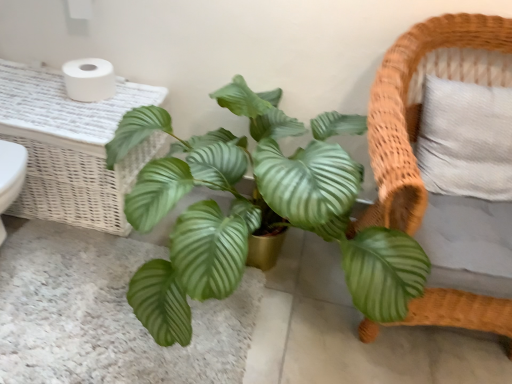
Question: Is white wicker table at upper left closer to the viewer compared to green glossy leaf at center?

Choices:
 (A) yes
 (B) no

Answer: (B)

Question: Does white wicker table at upper left have a smaller size compared to green glossy leaf at center?

Choices:
 (A) yes
 (B) no

Answer: (B)

Question: Is white wicker table at upper left facing away from green glossy leaf at center?

Choices:
 (A) yes
 (B) no

Answer: (B)

Question: Does white wicker table at upper left come behind green glossy leaf at center?

Choices:
 (A) yes
 (B) no

Answer: (A)

Question: Does white wicker table at upper left have a greater width compared to green glossy leaf at center?

Choices:
 (A) no
 (B) yes

Answer: (A)

Question: Is woven wood chair at right inside or outside of white wicker table at upper left?

Choices:
 (A) inside
 (B) outside

Answer: (B)

Question: Is woven wood chair at right wider or thinner than white wicker table at upper left?

Choices:
 (A) thin
 (B) wide

Answer: (B)

Question: Considering the positions of woven wood chair at right and white wicker table at upper left in the image, is woven wood chair at right taller or shorter than white wicker table at upper left?

Choices:
 (A) short
 (B) tall

Answer: (B)

Question: Is woven wood chair at right in front of or behind white wicker table at upper left in the image?

Choices:
 (A) behind
 (B) front

Answer: (B)

Question: Considering the positions of green glossy leafy plant at center and white matte toilet paper at upper left in the image, is green glossy leafy plant at center bigger or smaller than white matte toilet paper at upper left?

Choices:
 (A) big
 (B) small

Answer: (A)

Question: From a real-world perspective, is green glossy leafy plant at center physically located above or below white matte toilet paper at upper left?

Choices:
 (A) below
 (B) above

Answer: (A)

Question: Would you say green glossy leafy plant at center is inside or outside white matte toilet paper at upper left?

Choices:
 (A) inside
 (B) outside

Answer: (B)

Question: In the image, is green glossy leafy plant at center positioned in front of or behind white matte toilet paper at upper left?

Choices:
 (A) behind
 (B) front

Answer: (B)

Question: Is white matte toilet paper at upper left in front of or behind green glossy leaf at center in the image?

Choices:
 (A) behind
 (B) front

Answer: (A)

Question: Is point (78, 97) closer or farther from the camera than point (115, 241)?

Choices:
 (A) closer
 (B) farther

Answer: (A)